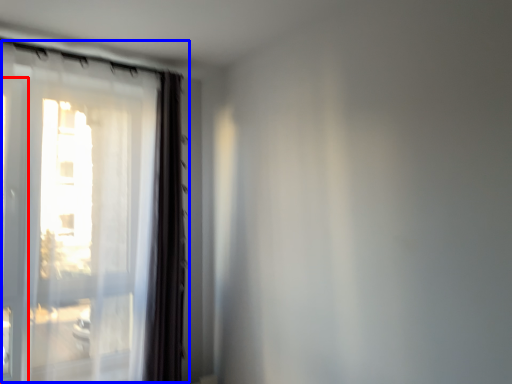
Question: Which object appears closest to the camera in this image, screen door (highlighted by a red box) or window (highlighted by a blue box)?

Choices:
 (A) screen door
 (B) window

Answer: (A)